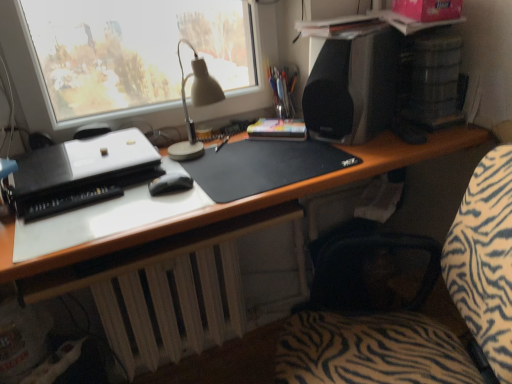
Question: From a real-world perspective, is metallic silver pen holder at upper center above or below black matte speaker at upper right?

Choices:
 (A) above
 (B) below

Answer: (B)

Question: Based on their positions, is metallic silver pen holder at upper center located to the left or right of black matte speaker at upper right?

Choices:
 (A) right
 (B) left

Answer: (B)

Question: Which object is positioned closest to the black matte desk at center?

Choices:
 (A) metallic silver pen holder at upper center
 (B) black matte mousepad at center
 (C) black matte speaker at upper right
 (D) black matte mouse at center
 (E) hardcover book at center

Answer: (B)

Question: Which object is the closest to the zebra-patterned fabric at center?

Choices:
 (A) black matte mousepad at center
 (B) metallic silver pen holder at upper center
 (C) black matte mouse at center
 (D) black matte speaker at upper right
 (E) black plastic printer at left

Answer: (A)